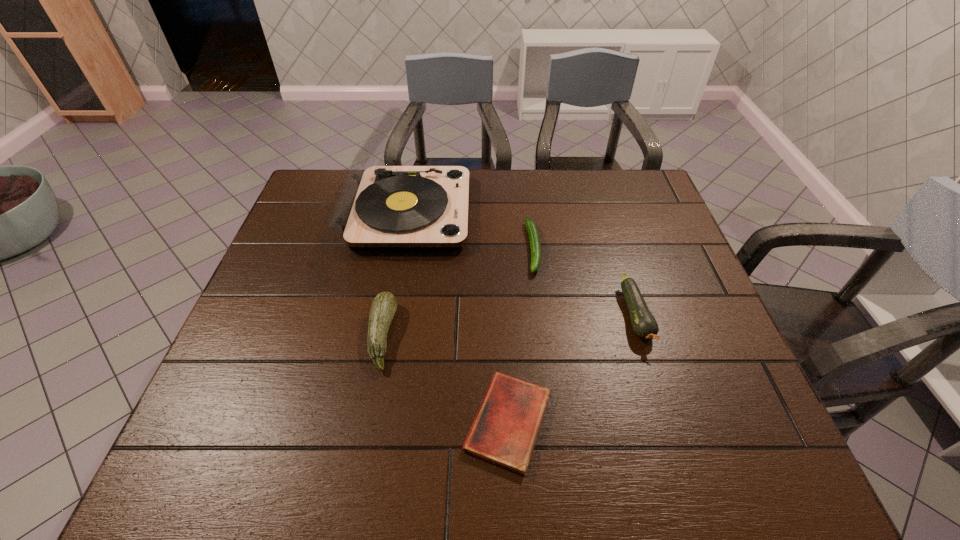
Where is `free space that satisfies the following two spatial constraints: 1. on the front-facing side of the shortest zucchini; 2. at the stem end of the leftmost zucchini`? The height and width of the screenshot is (540, 960). free space that satisfies the following two spatial constraints: 1. on the front-facing side of the shortest zucchini; 2. at the stem end of the leftmost zucchini is located at coordinates (544, 336).

At what (x,y) coordinates should I click in order to perform the action: click on free spot that satisfies the following two spatial constraints: 1. at the stem end of the leftmost zucchini; 2. on the left side of the diary. Please return your answer as a coordinate pair (x, y). The height and width of the screenshot is (540, 960). Looking at the image, I should click on (366, 422).

At what (x,y) coordinates should I click in order to perform the action: click on free space in the image that satisfies the following two spatial constraints: 1. on the back side of the shortest object; 2. with the tonearm facing the front of the tallest object. Please return your answer as a coordinate pair (x, y). This screenshot has width=960, height=540. Looking at the image, I should click on (498, 212).

The height and width of the screenshot is (540, 960). Identify the location of free space that satisfies the following two spatial constraints: 1. at the stem end of the leftmost zucchini; 2. on the back side of the shortest object. (366, 422).

Where is `free space that satisfies the following two spatial constraints: 1. with the tonearm facing the front of the diary; 2. on the right side of the tallest object`? free space that satisfies the following two spatial constraints: 1. with the tonearm facing the front of the diary; 2. on the right side of the tallest object is located at coordinates (369, 422).

Locate an element on the screen. The height and width of the screenshot is (540, 960). free spot that satisfies the following two spatial constraints: 1. at the blossom end of the rightmost object; 2. at the stem end of the leftmost zucchini is located at coordinates (642, 336).